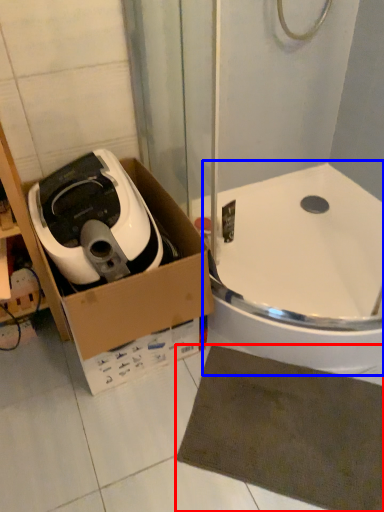
Question: Among these objects, which one is farthest to the camera, bath mat (highlighted by a red box) or bath (highlighted by a blue box)?

Choices:
 (A) bath mat
 (B) bath

Answer: (B)